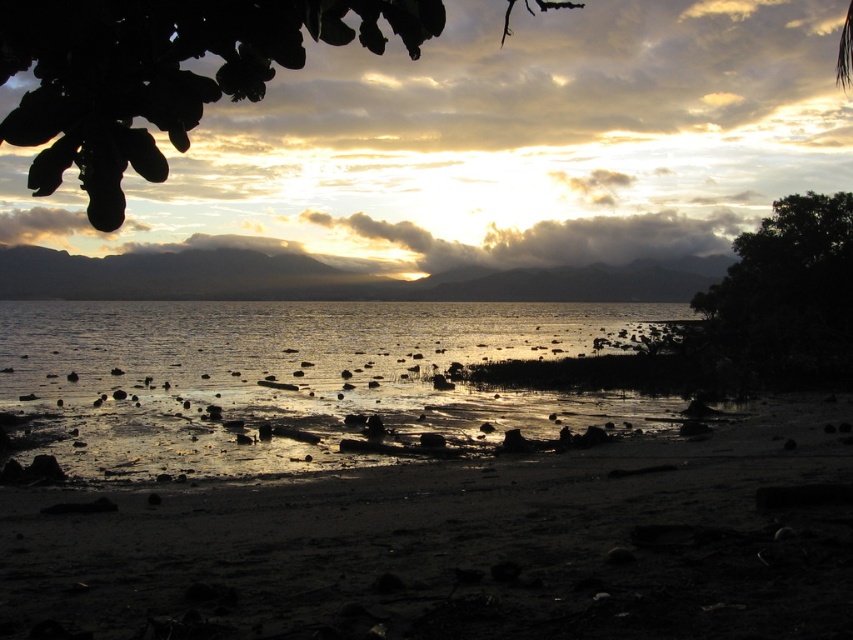
Is dull sand at lower center to the right of glistening water at center from the viewer's perspective?

Incorrect, dull sand at lower center is not on the right side of glistening water at center.

Between point (38, 620) and point (38, 378), which one is positioned in front?

Positioned in front is point (38, 620).

The height and width of the screenshot is (640, 853). What do you see at coordinates (466, 547) in the screenshot?
I see `dull sand at lower center` at bounding box center [466, 547].

Locate an element on the screen. This screenshot has width=853, height=640. dull sand at lower center is located at coordinates (466, 547).

From the picture: Does green leafy tree at upper center have a greater width compared to dark green leafy tree at right?

Yes, green leafy tree at upper center is wider than dark green leafy tree at right.

Which of these two, green leafy tree at upper center or dark green leafy tree at right, stands taller?

With more height is green leafy tree at upper center.

Is point (250, 90) more distant than point (840, 326)?

No, (250, 90) is closer to viewer.

At what (x,y) coordinates should I click in order to perform the action: click on green leafy tree at upper center. Please return your answer as a coordinate pair (x, y). The width and height of the screenshot is (853, 640). Looking at the image, I should click on (160, 74).

Can you confirm if glistening water at center is wider than dark green leafy tree at right?

Yes.

Which is behind, point (581, 330) or point (769, 362)?

The point (581, 330) is more distant.

Measure the distance between glistening water at center and camera.

glistening water at center and camera are 19.23 meters apart from each other.

At what (x,y) coordinates should I click in order to perform the action: click on glistening water at center. Please return your answer as a coordinate pair (x, y). The height and width of the screenshot is (640, 853). Looking at the image, I should click on (296, 376).